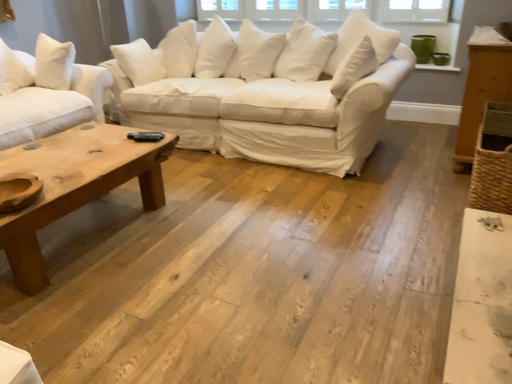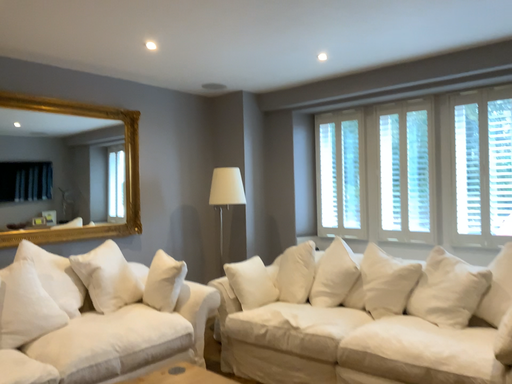
Question: How did the camera likely rotate when shooting the video?

Choices:
 (A) rotated upward
 (B) rotated downward

Answer: (A)